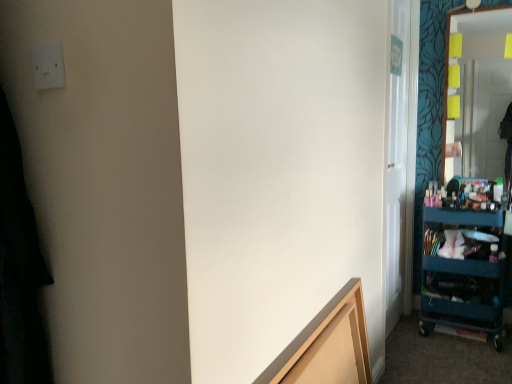
Question: Is light brown wood frame at lower center to the left or to the right of transparent glass door at right in the image?

Choices:
 (A) right
 (B) left

Answer: (B)

Question: Looking at the image, does light brown wood frame at lower center seem bigger or smaller compared to transparent glass door at right?

Choices:
 (A) small
 (B) big

Answer: (A)

Question: Which is nearer to the light brown wood frame at lower center?

Choices:
 (A) matte glass mirror at right
 (B) white plastic electric outlet at upper left
 (C) transparent glass door at right
 (D) teal plastic cart at right

Answer: (C)

Question: Considering the real-world distances, which object is closest to the teal plastic cart at right?

Choices:
 (A) matte glass mirror at right
 (B) white plastic electric outlet at upper left
 (C) light brown wood frame at lower center
 (D) transparent glass door at right

Answer: (D)